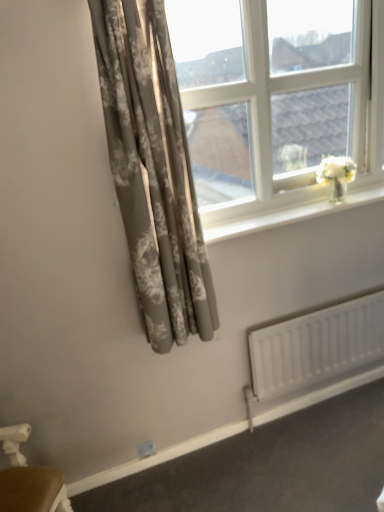
At what (x,y) coordinates should I click in order to perform the action: click on space that is in front of white matte radiator at lower right. Please return your answer as a coordinate pair (x, y). The image size is (384, 512). Looking at the image, I should click on pyautogui.click(x=328, y=449).